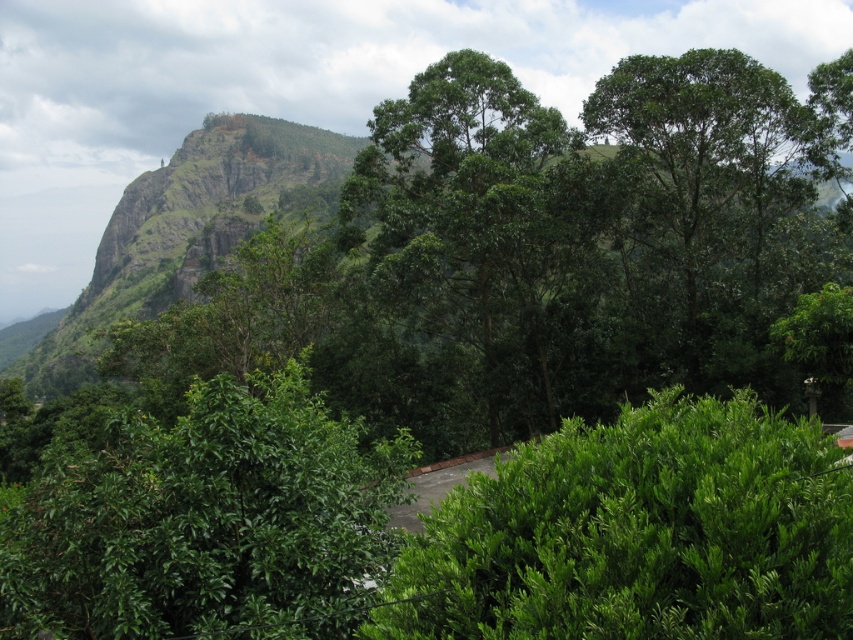
Based on the photo, you are a hiker planning to take a photo of the green leafy tree at center and the green leafy tree at upper right. Which tree should you stand closer to in order to capture both in a single frame?

To capture both the green leafy tree at center and the green leafy tree at upper right in a single frame, you should stand closer to the green leafy tree at upper right since it is smaller in size compared to the one at center, allowing both to fit within the camera view.

You are standing at the entrance of the pathway in the midground of the image. You want to reach the green leafy tree at center. Which direction should you walk to get there?

The green leafy tree at center is located at point (474, 230) in the image, so you should walk towards the center of the image to reach it.

You are a hiker standing on the path and see the green leafy tree at center and the green leafy tree at upper right. Which tree is closer to your left side?

The green leafy tree at center is positioned on the left side of green leafy tree at upper right, so the green leafy tree at center is closer to your left side.